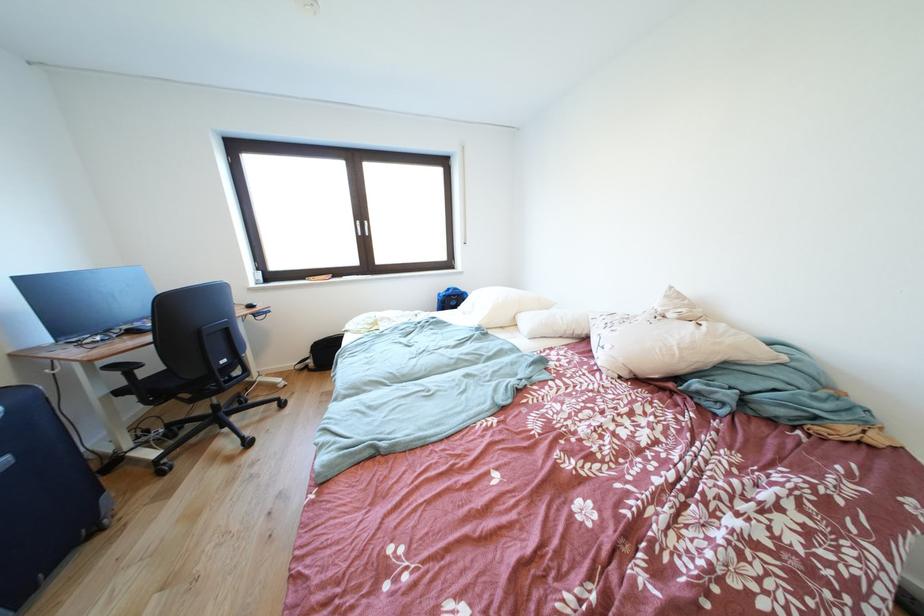
Locate an element on the screen. Image resolution: width=924 pixels, height=616 pixels. chair sitting surface is located at coordinates (164, 384).